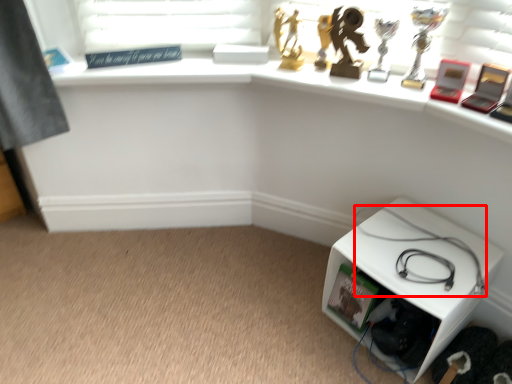
Question: From the image's perspective, considering the relative positions of cable (annotated by the red box) and furniture in the image provided, where is cable (annotated by the red box) located with respect to the staircase?

Choices:
 (A) above
 (B) below

Answer: (A)